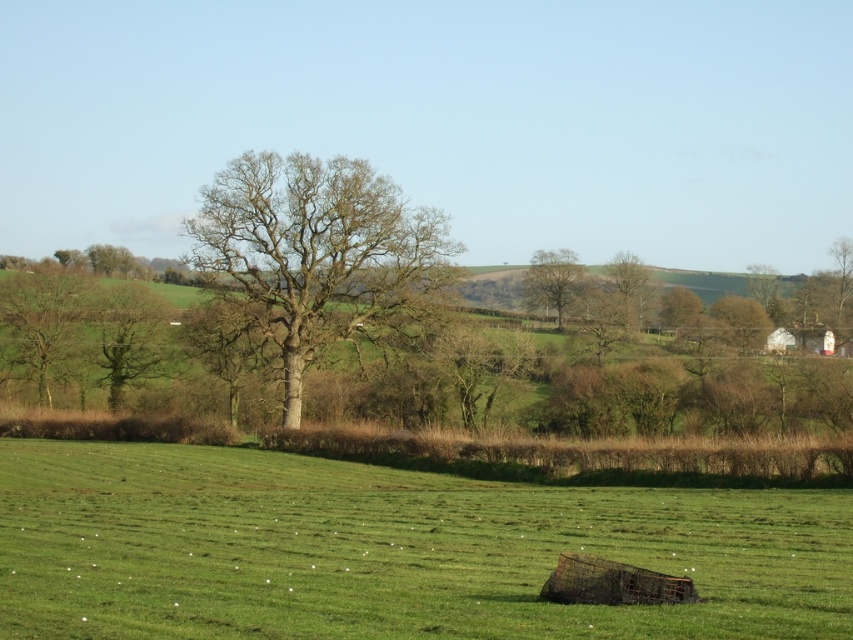
Question: Among these objects, which one is nearest to the camera?

Choices:
 (A) green leafy tree at upper left
 (B) bare wood tree at center
 (C) green grassy pasture at lower center
 (D) green leafy tree at left

Answer: (C)

Question: Does bare wood tree at center have a larger size compared to green leafy tree at upper left?

Choices:
 (A) yes
 (B) no

Answer: (A)

Question: Considering the real-world distances, which object is closest to the green leafy tree at center?

Choices:
 (A) green leafy tree at left
 (B) green leafy tree at upper left

Answer: (B)

Question: Is green grassy pasture at lower center bigger than green leafy tree at upper left?

Choices:
 (A) no
 (B) yes

Answer: (B)

Question: Is bare wood tree at center closer to the viewer compared to green leafy tree at left?

Choices:
 (A) no
 (B) yes

Answer: (B)

Question: Considering the real-world distances, which object is closest to the bare wood tree at center?

Choices:
 (A) green leafy tree at left
 (B) green leafy tree at center

Answer: (A)